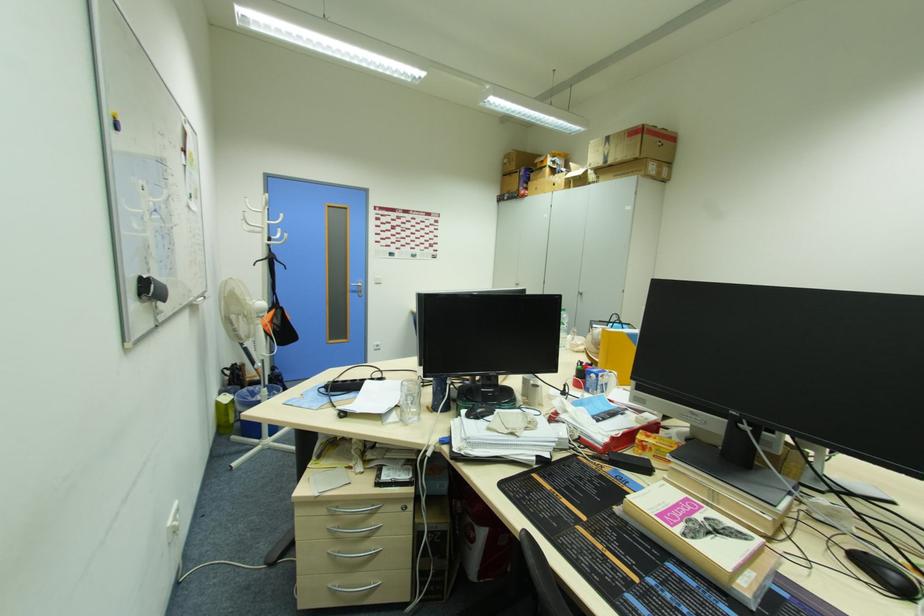
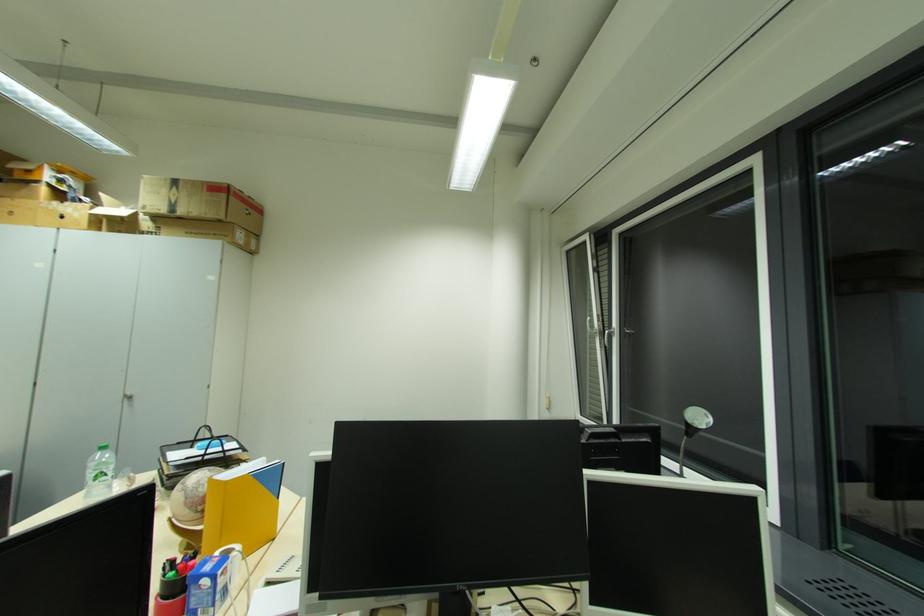
Find the pixel in the second image that matches pixel 582 296 in the first image.

(128, 400)